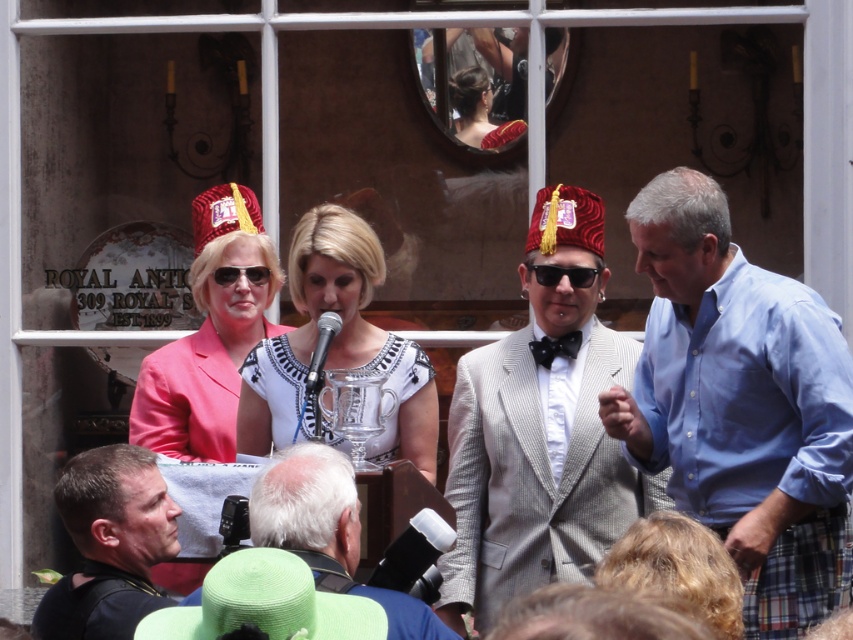
Question: Which of the following is the farthest from the observer?

Choices:
 (A) (251, 513)
 (B) (805, 396)
 (C) (78, 611)

Answer: (B)

Question: Can you confirm if silver pinstripe suit at center is wider than matte black hat at lower left?

Choices:
 (A) yes
 (B) no

Answer: (A)

Question: Considering the real-world distances, which object is closest to the black plastic goggles at center?

Choices:
 (A) gray textured suit at lower center
 (B) dark brown leather jacket at lower left
 (C) blue cotton shirt at right
 (D) white textured dress at center

Answer: (D)

Question: Is blue cotton shirt at right positioned in front of sunglasses at center?

Choices:
 (A) yes
 (B) no

Answer: (A)

Question: Which of these objects is positioned closest to the white textured dress at center?

Choices:
 (A) dark brown leather jacket at lower left
 (B) gray textured suit at lower center
 (C) sunglasses at center

Answer: (C)

Question: Does dark brown leather jacket at lower left have a larger size compared to sunglasses at center?

Choices:
 (A) yes
 (B) no

Answer: (A)